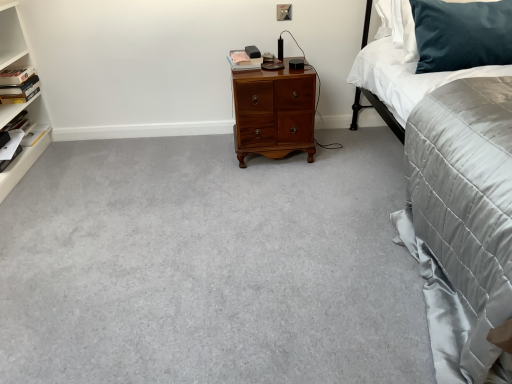
Where is `vacant area that is in front of matte pink book at center, placed as the third book when sorted from bottom to top`? Image resolution: width=512 pixels, height=384 pixels. vacant area that is in front of matte pink book at center, placed as the third book when sorted from bottom to top is located at coordinates click(x=254, y=67).